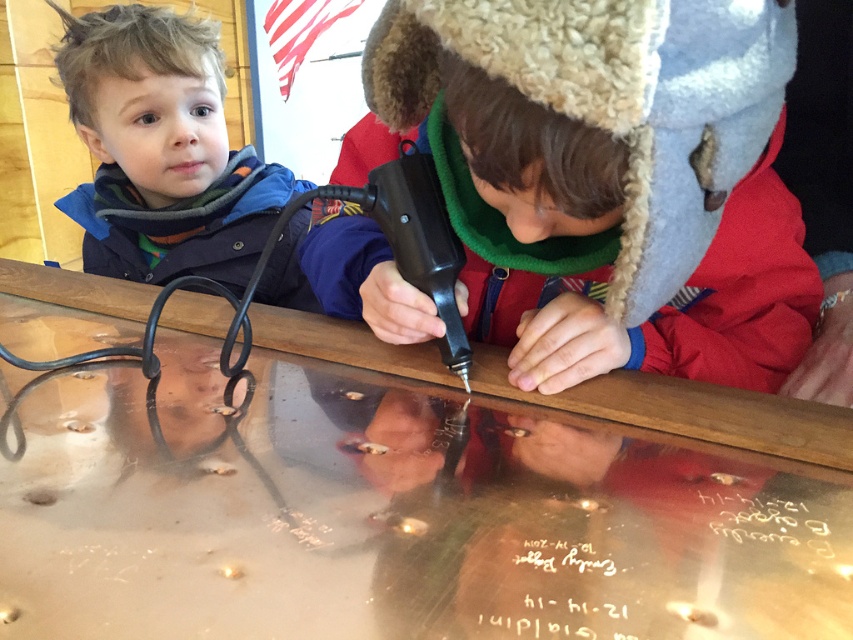
Question: Which point is farther from the camera taking this photo?

Choices:
 (A) (727, 285)
 (B) (204, 88)

Answer: (B)

Question: Which object is farther from the camera taking this photo?

Choices:
 (A) matte black glue gun at center
 (B) blue fleece jacket at upper left
 (C) metallic polished table at center

Answer: (B)

Question: Can you confirm if metallic polished table at center is thinner than matte black glue gun at center?

Choices:
 (A) yes
 (B) no

Answer: (B)

Question: Which point is closer to the camera?

Choices:
 (A) matte black glue gun at center
 (B) metallic polished table at center

Answer: (B)

Question: Is matte black glue gun at center thinner than blue fleece jacket at upper left?

Choices:
 (A) no
 (B) yes

Answer: (A)

Question: Does metallic polished table at center appear over matte black glue gun at center?

Choices:
 (A) no
 (B) yes

Answer: (A)